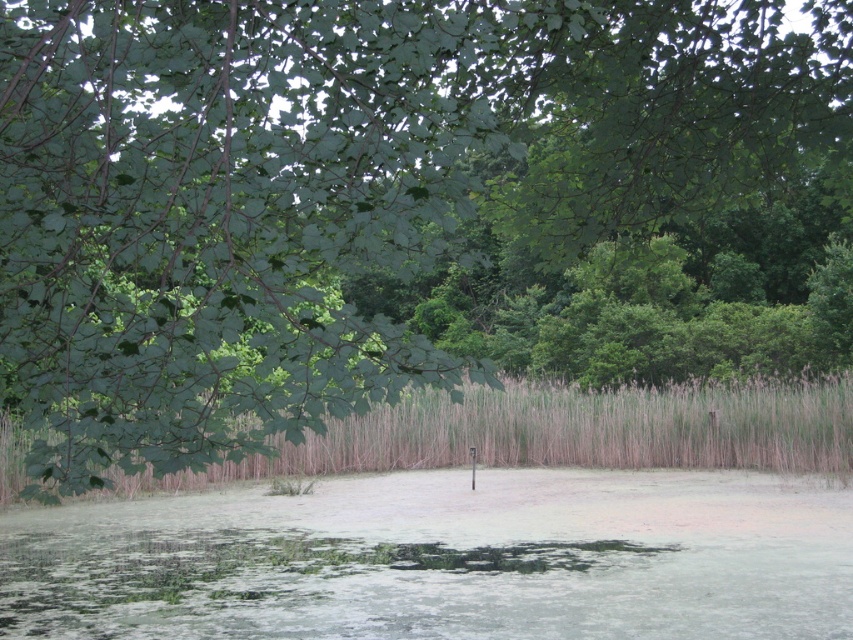
Question: Which of the following is the farthest from the observer?

Choices:
 (A) green algae water at center
 (B) brown grass at center

Answer: (A)

Question: Does green algae water at center lie behind brown grass at center?

Choices:
 (A) no
 (B) yes

Answer: (B)

Question: Which point is farther from the camera taking this photo?

Choices:
 (A) (785, 632)
 (B) (848, 372)

Answer: (B)

Question: Does green algae water at center have a lesser width compared to brown grass at center?

Choices:
 (A) no
 (B) yes

Answer: (B)

Question: Is green algae water at center bigger than brown grass at center?

Choices:
 (A) yes
 (B) no

Answer: (B)